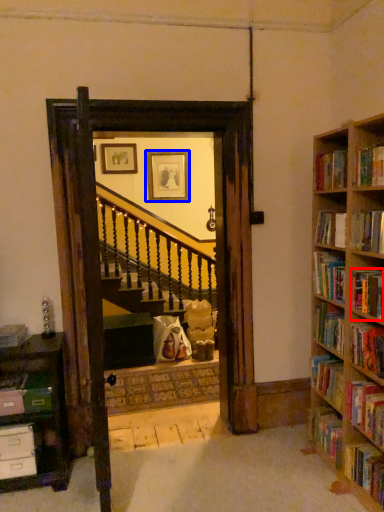
Question: Which object is further to the camera taking this photo, book (highlighted by a red box) or picture frame (highlighted by a blue box)?

Choices:
 (A) book
 (B) picture frame

Answer: (B)